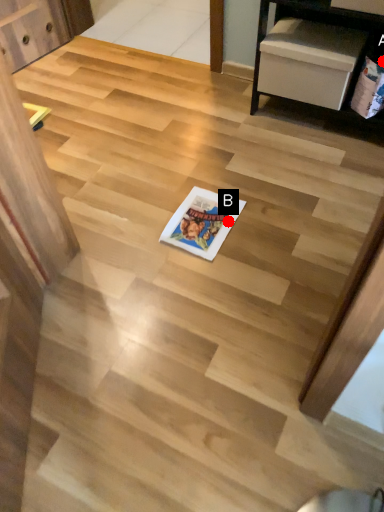
Question: Two points are circled on the image, labeled by A and B beside each circle. Which point is farther to the camera?

Choices:
 (A) A is further
 (B) B is further

Answer: (A)